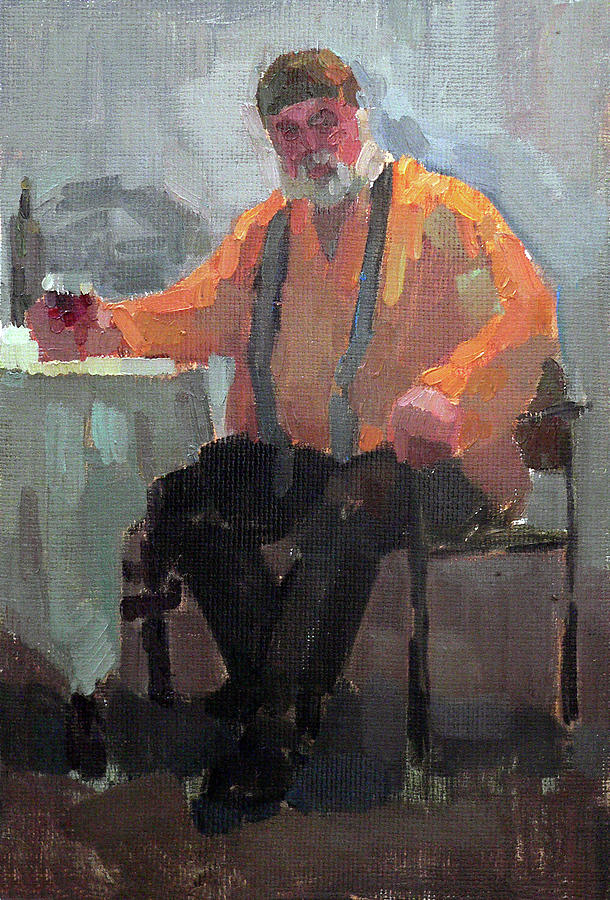
At what (x,y) coordinates should I click in order to perform the action: click on wine bottle. Please return your answer as a coordinate pair (x, y). The height and width of the screenshot is (900, 610). Looking at the image, I should click on (29, 248).